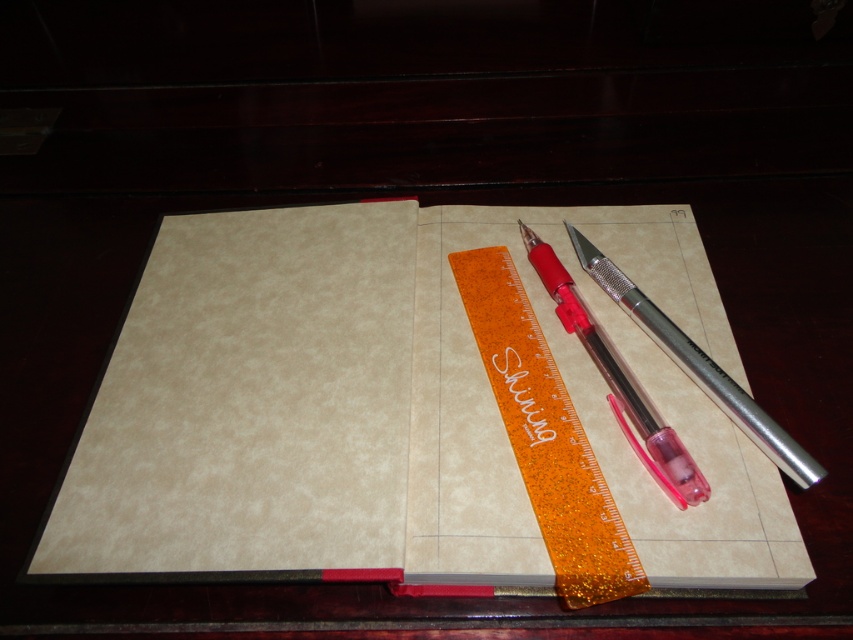
Question: Does orange glitter ruler at center have a lesser width compared to transparent plastic pencil at center?

Choices:
 (A) no
 (B) yes

Answer: (A)

Question: Which point is closer to the camera taking this photo?

Choices:
 (A) (553, 474)
 (B) (636, 288)
 (C) (662, 426)
 (D) (468, 244)

Answer: (A)

Question: Which point is closer to the camera taking this photo?

Choices:
 (A) (677, 465)
 (B) (172, 269)
 (C) (488, 358)
 (D) (817, 474)

Answer: (D)

Question: Can you confirm if matte paper notebook at center is positioned to the right of orange glitter ruler at center?

Choices:
 (A) no
 (B) yes

Answer: (A)

Question: Can you confirm if matte paper notebook at center is positioned to the right of orange glitter ruler at center?

Choices:
 (A) no
 (B) yes

Answer: (A)

Question: Among these points, which one is farthest from the camera?

Choices:
 (A) (554, 296)
 (B) (590, 499)
 (C) (352, 560)

Answer: (A)